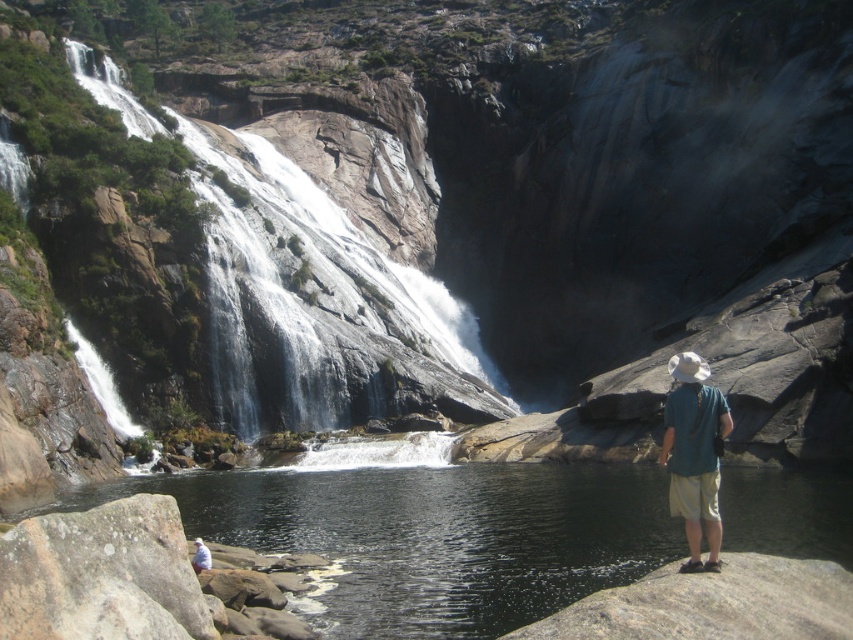
In order to click on white textured water at left in this screenshot , I will do `click(318, 305)`.

How far apart are white textured water at left and green fabric shirt at lower right?

47.55 meters

Image resolution: width=853 pixels, height=640 pixels. In order to click on white textured water at left in this screenshot , I will do `click(318, 305)`.

Locate an element on the screen. Image resolution: width=853 pixels, height=640 pixels. white textured water at left is located at coordinates (318, 305).

Between point (25, 600) and point (685, 477), which one is positioned in front?

Positioned in front is point (25, 600).

Can you confirm if gray rough rock at lower left is positioned to the right of green fabric shirt at lower right?

In fact, gray rough rock at lower left is to the left of green fabric shirt at lower right.

Locate an element on the screen. gray rough rock at lower left is located at coordinates (102, 576).

Who is more forward, (412, 387) or (202, 557)?

Point (202, 557) is in front.

Can you confirm if white textured water at left is positioned to the right of white cotton shirt at lower center?

No, white textured water at left is not to the right of white cotton shirt at lower center.

The image size is (853, 640). Identify the location of white textured water at left. (318, 305).